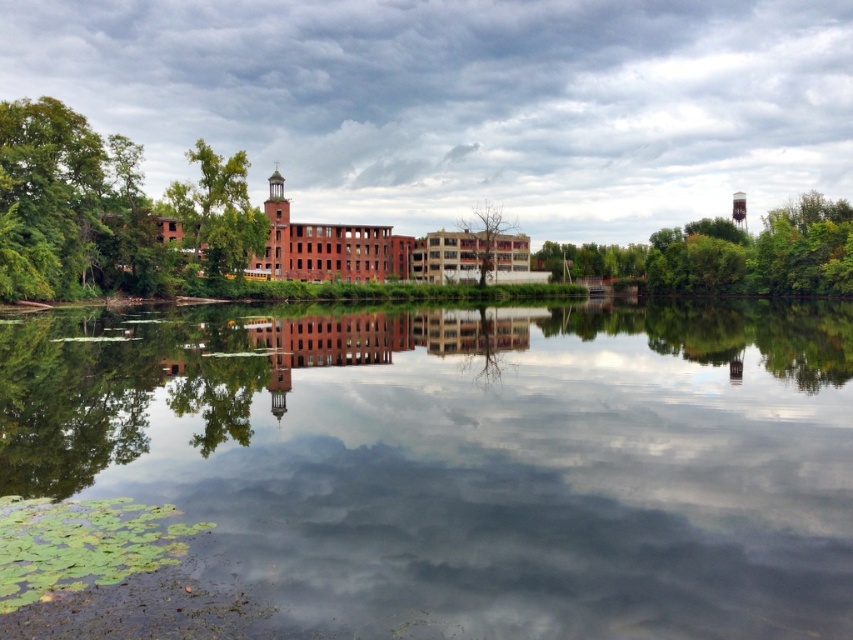
Who is positioned more to the left, transparent glass river at center or green leafy tree at upper left?

green leafy tree at upper left

The image size is (853, 640). Describe the element at coordinates (469, 458) in the screenshot. I see `transparent glass river at center` at that location.

I want to click on transparent glass river at center, so click(469, 458).

This screenshot has height=640, width=853. I want to click on green leafy tree at left, so click(x=111, y=211).

Who is taller, green leafy tree at left or brown leafless tree at center?

brown leafless tree at center

Which is behind, point (206, 176) or point (490, 228)?

Point (490, 228)

Image resolution: width=853 pixels, height=640 pixels. Find the location of `green leafy tree at left`. green leafy tree at left is located at coordinates (111, 211).

How much distance is there between transparent glass river at center and green leafy tree at left?

A distance of 33.48 meters exists between transparent glass river at center and green leafy tree at left.

In the scene shown: Does transparent glass river at center appear over green leafy tree at left?

No, transparent glass river at center is not above green leafy tree at left.

Where is `transparent glass river at center`? The image size is (853, 640). transparent glass river at center is located at coordinates (469, 458).